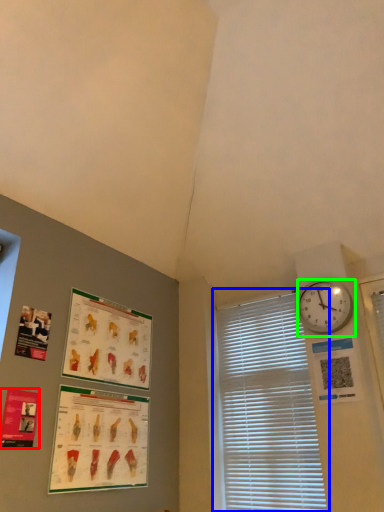
Question: Estimate the real-world distances between objects in this image. Which object is farther from poster page (highlighted by a red box), window blind (highlighted by a blue box) or wall clock (highlighted by a green box)?

Choices:
 (A) window blind
 (B) wall clock

Answer: (B)